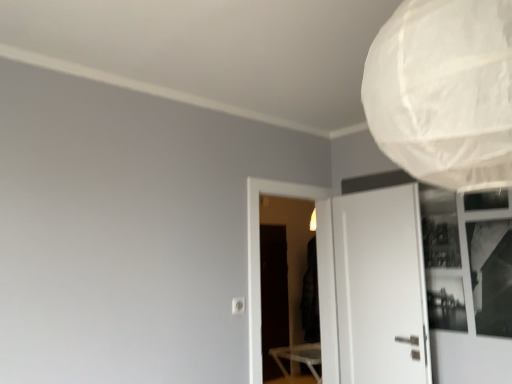
Question: From a real-world perspective, is white matte door at right on top of black glass window at upper right?

Choices:
 (A) yes
 (B) no

Answer: (B)

Question: Can you confirm if white matte door at right is bigger than black glass window at upper right?

Choices:
 (A) yes
 (B) no

Answer: (A)

Question: Could you tell me if white matte door at right is turned towards black glass window at upper right?

Choices:
 (A) no
 (B) yes

Answer: (A)

Question: Considering the relative positions of white matte door at right and black glass window at upper right in the image provided, is white matte door at right behind black glass window at upper right?

Choices:
 (A) yes
 (B) no

Answer: (A)

Question: Can you confirm if white matte door at right is smaller than black glass window at upper right?

Choices:
 (A) no
 (B) yes

Answer: (A)

Question: Looking at their shapes, would you say transparent plastic screen door at center, which is counted as the second screen door, starting from the back, is wider or thinner than black matte screen door at center, the 2th screen door when ordered from front to back?

Choices:
 (A) thin
 (B) wide

Answer: (B)

Question: In the image, is transparent plastic screen door at center, acting as the 1th screen door starting from the front, positioned in front of or behind black matte screen door at center, the 2th screen door when ordered from front to back?

Choices:
 (A) behind
 (B) front

Answer: (B)

Question: Considering the positions of point (287, 228) and point (269, 289), is point (287, 228) closer or farther from the camera than point (269, 289)?

Choices:
 (A) closer
 (B) farther

Answer: (B)

Question: From the image's perspective, is transparent plastic screen door at center, acting as the 1th screen door starting from the front, located above or below black matte screen door at center, the 2th screen door when ordered from front to back?

Choices:
 (A) above
 (B) below

Answer: (A)

Question: Is black matte screen door at center, the 2th screen door when ordered from front to back, situated inside black glass window at upper right or outside?

Choices:
 (A) outside
 (B) inside

Answer: (A)

Question: From a real-world perspective, is black matte screen door at center, the first screen door positioned from the back, physically located above or below black glass window at upper right?

Choices:
 (A) above
 (B) below

Answer: (B)

Question: In terms of size, does black matte screen door at center, the first screen door positioned from the back, appear bigger or smaller than black glass window at upper right?

Choices:
 (A) big
 (B) small

Answer: (A)

Question: From the image's perspective, is black matte screen door at center, the first screen door positioned from the back, positioned above or below black glass window at upper right?

Choices:
 (A) below
 (B) above

Answer: (A)

Question: Is point (480, 3) closer or farther from the camera than point (284, 266)?

Choices:
 (A) farther
 (B) closer

Answer: (B)

Question: Considering their positions, is white paper lampshade at upper right located in front of or behind black matte screen door at center, the 2th screen door when ordered from front to back?

Choices:
 (A) behind
 (B) front

Answer: (B)